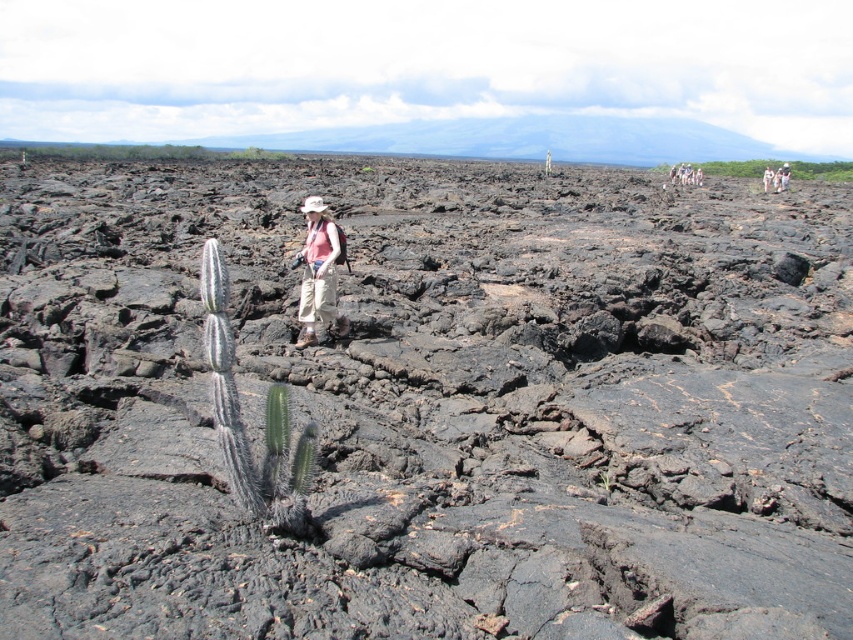
Is point (224, 460) closer to camera compared to point (775, 163)?

Yes, it is in front of point (775, 163).

Can you confirm if green spiny cactus at center is positioned above green spiky cactus at upper right?

Actually, green spiny cactus at center is below green spiky cactus at upper right.

Between point (274, 468) and point (839, 172), which one is positioned behind?

The point (839, 172) is behind.

Locate an element on the screen. The image size is (853, 640). green spiny cactus at center is located at coordinates (241, 422).

Is matte pink shirt at center shorter than brown fabric pants at center?

Indeed, matte pink shirt at center has a lesser height compared to brown fabric pants at center.

Can you confirm if matte pink shirt at center is wider than brown fabric pants at center?

No.

You are a GUI agent. You are given a task and a screenshot of the screen. Output one action in this format:
    pyautogui.click(x=<x>, y=<y>)
    Task: Click on the matte pink shirt at center
    This screenshot has height=640, width=853.
    Given the screenshot: What is the action you would take?
    pyautogui.click(x=318, y=273)

The width and height of the screenshot is (853, 640). What are the coordinates of `matte pink shirt at center` in the screenshot? It's located at [x=318, y=273].

Between matte pink shirt at center and green spiky cactus at center, which one has more height?

Standing taller between the two is green spiky cactus at center.

Is point (311, 225) farther from viewer compared to point (366, 166)?

No, it is not.

Find the location of a particular element. This screenshot has height=640, width=853. matte pink shirt at center is located at coordinates (318, 273).